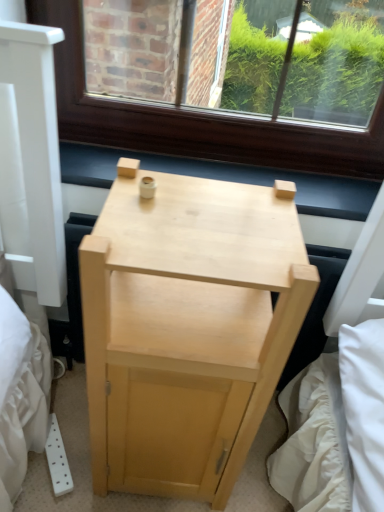
Question: In terms of width, does natural wood nightstand at center look wider or thinner when compared to light wood at center?

Choices:
 (A) thin
 (B) wide

Answer: (B)

Question: Relative to light wood at center, is natural wood nightstand at center in front or behind?

Choices:
 (A) behind
 (B) front

Answer: (B)

Question: Considering the positions of natural wood nightstand at center and light wood at center in the image, is natural wood nightstand at center taller or shorter than light wood at center?

Choices:
 (A) short
 (B) tall

Answer: (B)

Question: Looking at their shapes, would you say light wood at center is wider or thinner than natural wood nightstand at center?

Choices:
 (A) thin
 (B) wide

Answer: (A)

Question: From a real-world perspective, relative to natural wood nightstand at center, is light wood at center vertically above or below?

Choices:
 (A) below
 (B) above

Answer: (B)

Question: In terms of height, does light wood at center look taller or shorter compared to natural wood nightstand at center?

Choices:
 (A) tall
 (B) short

Answer: (B)

Question: Is light wood at center in front of or behind natural wood nightstand at center in the image?

Choices:
 (A) front
 (B) behind

Answer: (B)